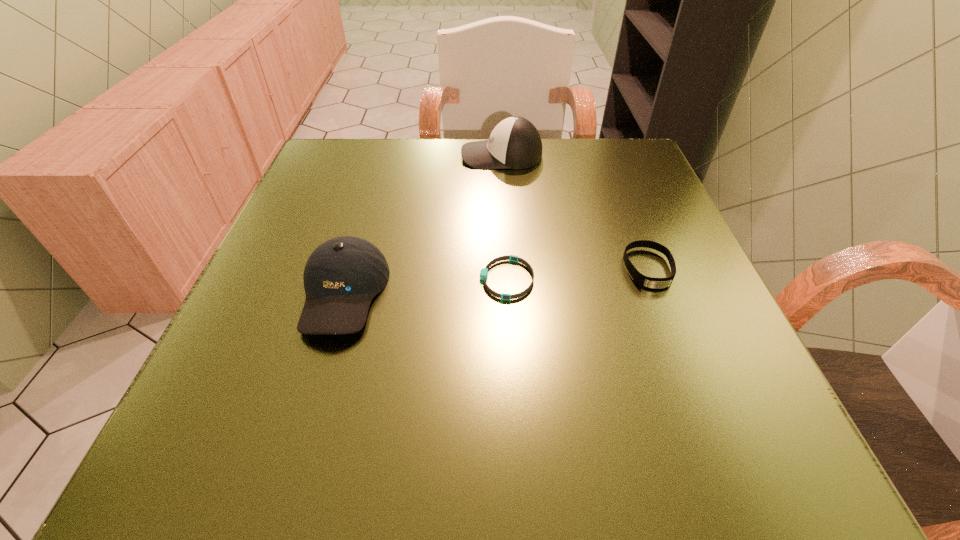
The image size is (960, 540). In order to click on vacant space located 0.190m on the front panel of the farthest object in this screenshot , I will do `click(381, 156)`.

Find the location of a particular element. The width and height of the screenshot is (960, 540). free space located on the front-facing side of the leftmost object is located at coordinates (303, 428).

Locate an element on the screen. vacant position located 0.300m on the display of the right wristband is located at coordinates click(x=728, y=474).

Find the location of a particular element. The height and width of the screenshot is (540, 960). free space located 0.140m on the buckle of the shortest object is located at coordinates pyautogui.click(x=397, y=279).

Where is `free spot located 0.280m on the buckle of the shortest object`? free spot located 0.280m on the buckle of the shortest object is located at coordinates (316, 279).

The height and width of the screenshot is (540, 960). I want to click on vacant position located 0.050m on the buckle of the shortest object, so click(x=450, y=279).

Locate an element on the screen. Image resolution: width=960 pixels, height=540 pixels. object at the far edge is located at coordinates (515, 143).

Where is `object that is at the left edge`? object that is at the left edge is located at coordinates (342, 275).

You are a GUI agent. You are given a task and a screenshot of the screen. Output one action in this format:
    pyautogui.click(x=<x>, y=<y>)
    Task: Click on the object at the right edge
    The image size is (960, 540).
    Given the screenshot: What is the action you would take?
    pyautogui.click(x=647, y=282)

In the image, there is a desktop. Where is `free region at the far edge`? free region at the far edge is located at coordinates (557, 194).